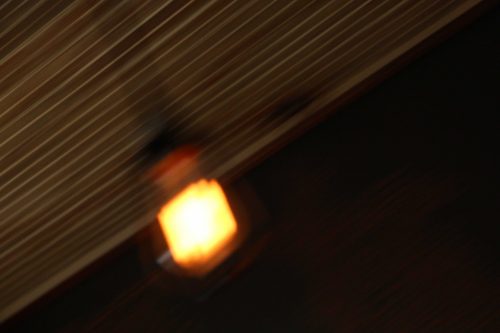
You are a GUI agent. You are given a task and a screenshot of the screen. Output one action in this format:
    pyautogui.click(x=<x>, y=<y>)
    Task: Click on the plastic covering for light
    
    Given the screenshot: What is the action you would take?
    pyautogui.click(x=214, y=190)